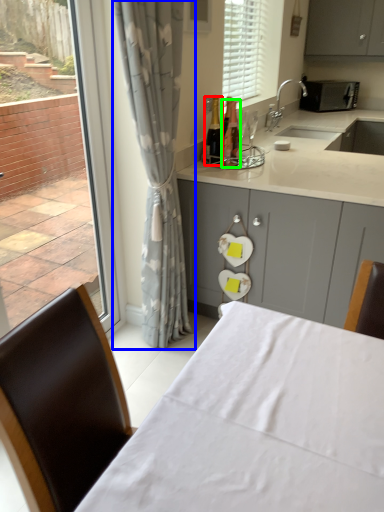
Question: Estimate the real-world distances between objects in this image. Which object is closer to bottle (highlighted by a red box), curtain (highlighted by a blue box) or bottle (highlighted by a green box)?

Choices:
 (A) curtain
 (B) bottle

Answer: (B)